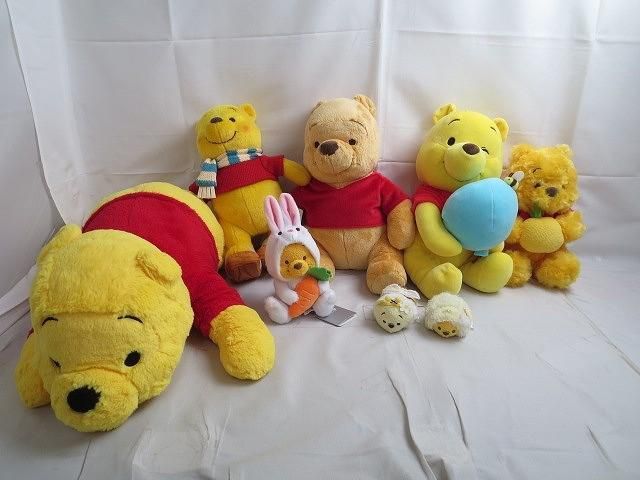
What are the coordinates of `plush toys` in the screenshot? It's located at (129, 266), (228, 143), (326, 126), (460, 141), (547, 187), (441, 317), (390, 315), (294, 259).